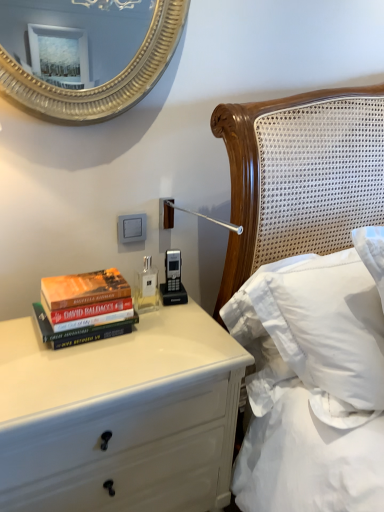
Where is `free space in front of hardcover books at left`? free space in front of hardcover books at left is located at coordinates (76, 369).